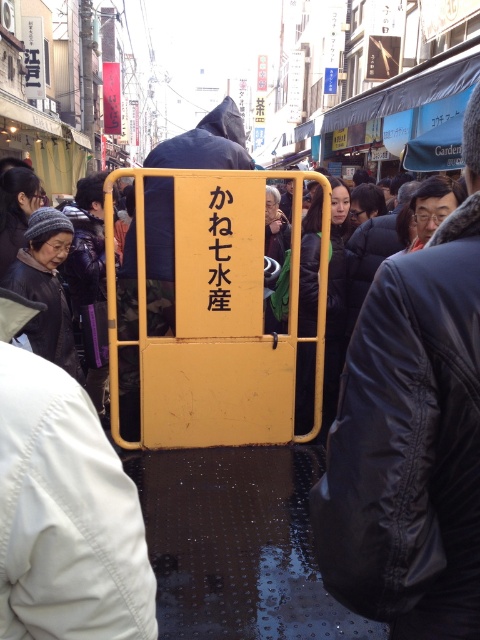
You are a tourist standing in the middle of the street. You see the yellow matte gate at center and the dark gray knit hat at left. Which object is closer to you?

The yellow matte gate at center is closer to you because it is in front of the dark gray knit hat at left.

You are a delivery person trying to navigate through the narrow alleyway. The yellow matte gate at center is blocking your path. Can you pass through the gate sideways while carrying a dark gray knit hat at left that is wider than the gate?

The yellow matte gate at center is thinner than the dark gray knit hat at left, meaning the gate is narrower. Since the dark gray knit hat at left is wider than the gate, you cannot pass through the gate sideways while carrying it.